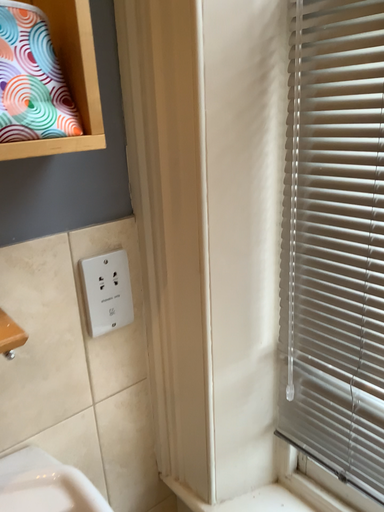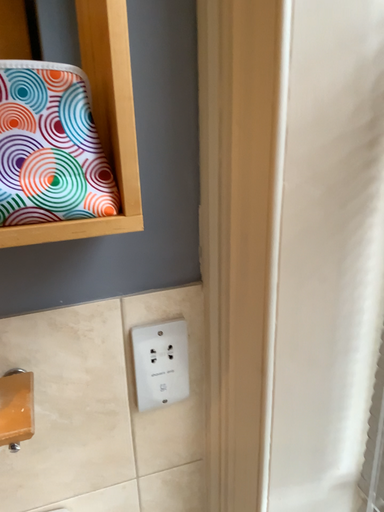
Question: How did the camera likely rotate when shooting the video?

Choices:
 (A) rotated right
 (B) rotated left

Answer: (B)